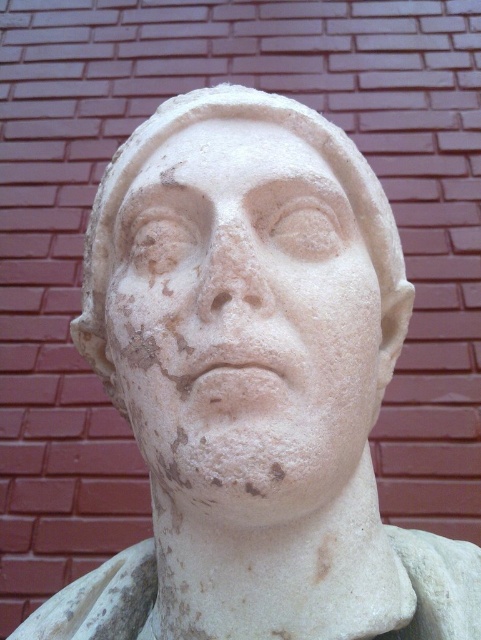
Question: Which object appears closest to the camera in this image?

Choices:
 (A) white marble forehead at center
 (B) white marble face at center

Answer: (B)

Question: Can you confirm if white marble face at center is wider than white marble forehead at center?

Choices:
 (A) no
 (B) yes

Answer: (B)

Question: Can you confirm if white marble face at center is smaller than white marble forehead at center?

Choices:
 (A) yes
 (B) no

Answer: (B)

Question: Observing the image, what is the correct spatial positioning of white marble face at center in reference to white marble forehead at center?

Choices:
 (A) right
 (B) left

Answer: (B)

Question: Which of the following is the closest to the observer?

Choices:
 (A) (290, 148)
 (B) (218, 141)

Answer: (B)

Question: Which point is farther from the camera taking this photo?

Choices:
 (A) (289, 125)
 (B) (243, 248)

Answer: (A)